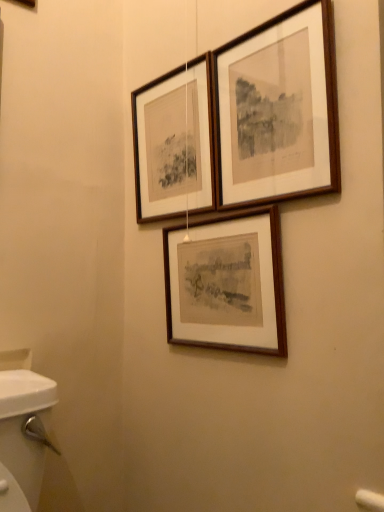
Question: Could you tell me if wooden frame at center, positioned as the first picture frame in bottom-to-top order, is facing wooden frame at upper center, which ranks as the second picture frame in top-to-bottom order?

Choices:
 (A) no
 (B) yes

Answer: (A)

Question: Is wooden frame at center, which is the third picture frame in top-to-bottom order, thinner than wooden frame at upper center, the 2th picture frame ordered from the bottom?

Choices:
 (A) no
 (B) yes

Answer: (A)

Question: Does wooden frame at center, which is the third picture frame in top-to-bottom order, appear on the right side of wooden frame at upper center, which ranks as the second picture frame in top-to-bottom order?

Choices:
 (A) yes
 (B) no

Answer: (A)

Question: Are wooden frame at center, positioned as the first picture frame in bottom-to-top order, and wooden frame at upper center, which ranks as the second picture frame in top-to-bottom order, beside each other?

Choices:
 (A) no
 (B) yes

Answer: (A)

Question: From a real-world perspective, is wooden frame at center, positioned as the first picture frame in bottom-to-top order, positioned under wooden frame at upper center, which ranks as the second picture frame in top-to-bottom order, based on gravity?

Choices:
 (A) no
 (B) yes

Answer: (B)

Question: Considering the positions of point (248, 96) and point (165, 302), is point (248, 96) closer or farther from the camera than point (165, 302)?

Choices:
 (A) farther
 (B) closer

Answer: (B)

Question: Is wooden picture frame at upper center, which is the 3th picture frame in bottom-to-top order, wider or thinner than wooden frame at center, positioned as the first picture frame in bottom-to-top order?

Choices:
 (A) wide
 (B) thin

Answer: (B)

Question: From the image's perspective, is wooden picture frame at upper center, the 1th picture frame when ordered from top to bottom, located above or below wooden frame at center, which is the third picture frame in top-to-bottom order?

Choices:
 (A) above
 (B) below

Answer: (A)

Question: Considering the positions of wooden picture frame at upper center, which is the 3th picture frame in bottom-to-top order, and wooden frame at center, which is the third picture frame in top-to-bottom order, in the image, is wooden picture frame at upper center, which is the 3th picture frame in bottom-to-top order, bigger or smaller than wooden frame at center, which is the third picture frame in top-to-bottom order,?

Choices:
 (A) small
 (B) big

Answer: (A)

Question: From a real-world perspective, is wooden picture frame at upper center, the 1th picture frame when ordered from top to bottom, physically located above or below wooden frame at upper center, the 2th picture frame ordered from the bottom?

Choices:
 (A) below
 (B) above

Answer: (A)

Question: In the image, is wooden picture frame at upper center, the 1th picture frame when ordered from top to bottom, positioned in front of or behind wooden frame at upper center, which ranks as the second picture frame in top-to-bottom order?

Choices:
 (A) front
 (B) behind

Answer: (A)

Question: Is wooden picture frame at upper center, which is the 3th picture frame in bottom-to-top order, spatially inside wooden frame at upper center, the 2th picture frame ordered from the bottom, or outside of it?

Choices:
 (A) outside
 (B) inside

Answer: (A)

Question: Is point (322, 11) closer or farther from the camera than point (195, 204)?

Choices:
 (A) farther
 (B) closer

Answer: (B)

Question: Does point (241, 234) appear closer or farther from the camera than point (208, 133)?

Choices:
 (A) farther
 (B) closer

Answer: (B)

Question: Is wooden frame at center, positioned as the first picture frame in bottom-to-top order, inside or outside of wooden frame at upper center, the 2th picture frame ordered from the bottom?

Choices:
 (A) outside
 (B) inside

Answer: (A)